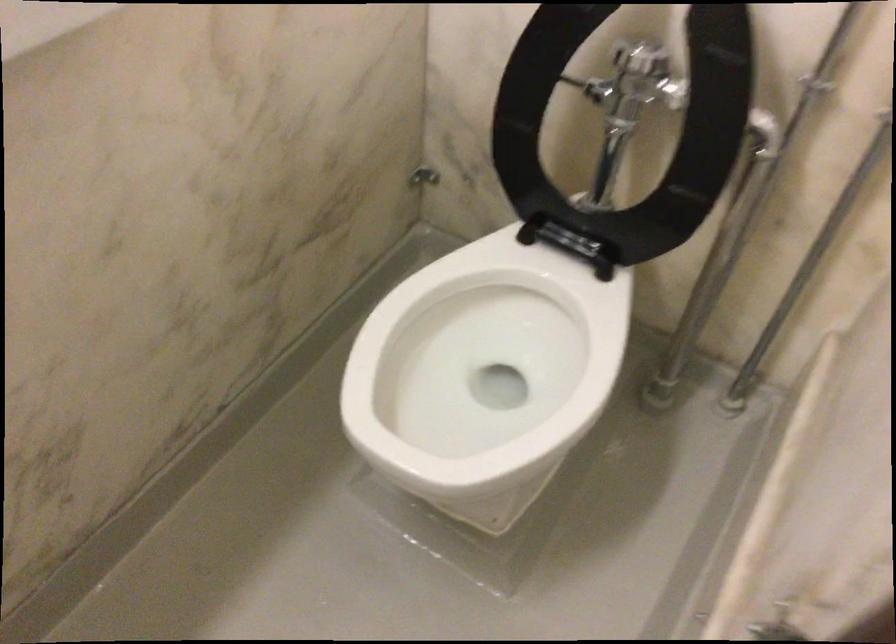
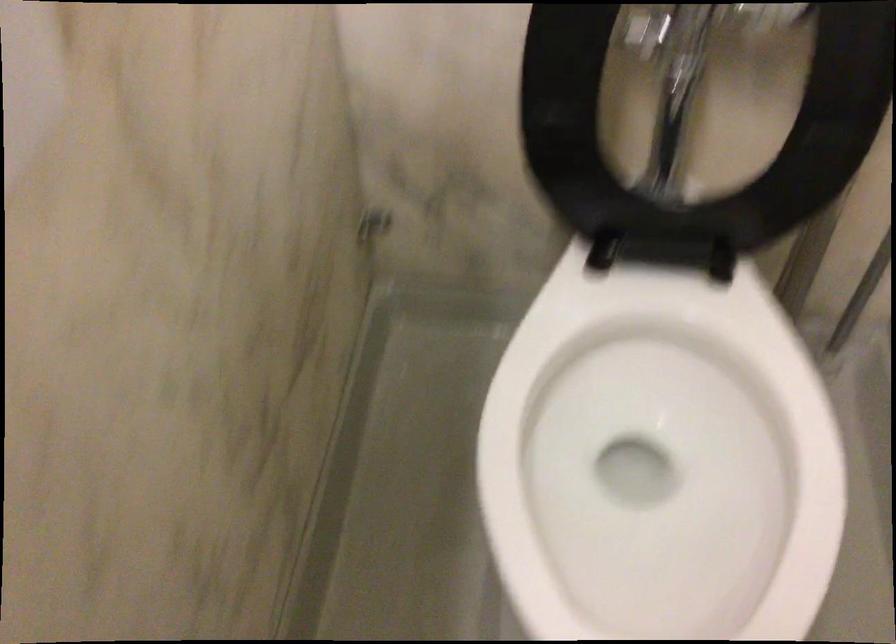
Question: The camera is either moving clockwise (left) or counter-clockwise (right) around the object. The first image is from the beginning of the video and the second image is from the end. Is the camera moving left or right when shooting the video?

Choices:
 (A) Left
 (B) Right

Answer: (A)